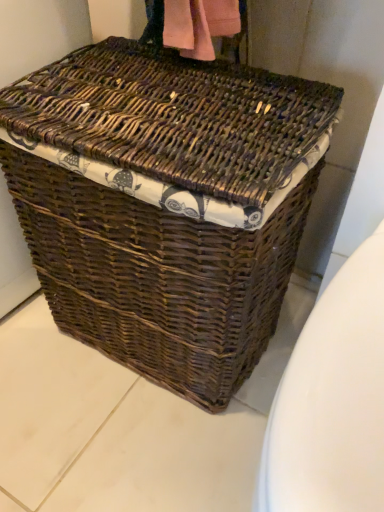
Image resolution: width=384 pixels, height=512 pixels. In order to click on brown wicker picnic basket at center in this screenshot , I will do `click(165, 203)`.

This screenshot has width=384, height=512. What do you see at coordinates (165, 203) in the screenshot? I see `brown wicker picnic basket at center` at bounding box center [165, 203].

The width and height of the screenshot is (384, 512). Describe the element at coordinates (332, 400) in the screenshot. I see `white glossy toilet bowl at lower right` at that location.

Image resolution: width=384 pixels, height=512 pixels. In order to click on white glossy toilet bowl at lower right in this screenshot , I will do `click(332, 400)`.

Locate an element on the screen. This screenshot has height=512, width=384. brown wicker picnic basket at center is located at coordinates (165, 203).

Which is more to the right, white glossy toilet bowl at lower right or brown wicker picnic basket at center?

Positioned to the right is white glossy toilet bowl at lower right.

Is white glossy toilet bowl at lower right positioned in front of brown wicker picnic basket at center?

Yes, it is.

Which point is more distant from viewer, (297, 344) or (77, 242)?

The point (77, 242) is behind.

From the image's perspective, which is above, white glossy toilet bowl at lower right or brown wicker picnic basket at center?

brown wicker picnic basket at center appears higher in the image.

Looking at this image, from a real-world perspective, which is physically above, white glossy toilet bowl at lower right or brown wicker picnic basket at center?

brown wicker picnic basket at center.

Can you confirm if white glossy toilet bowl at lower right is thinner than brown wicker picnic basket at center?

Answer: No, white glossy toilet bowl at lower right is not thinner than brown wicker picnic basket at center.

Is white glossy toilet bowl at lower right shorter than brown wicker picnic basket at center?

Correct, white glossy toilet bowl at lower right is not as tall as brown wicker picnic basket at center.

Is white glossy toilet bowl at lower right bigger or smaller than brown wicker picnic basket at center?

Clearly, white glossy toilet bowl at lower right is smaller in size than brown wicker picnic basket at center.

Is white glossy toilet bowl at lower right inside or outside of brown wicker picnic basket at center?

white glossy toilet bowl at lower right is not inside brown wicker picnic basket at center, it's outside.

Is white glossy toilet bowl at lower right directly adjacent to brown wicker picnic basket at center?

No, white glossy toilet bowl at lower right is not with brown wicker picnic basket at center.

Is white glossy toilet bowl at lower right aimed at brown wicker picnic basket at center?

No, white glossy toilet bowl at lower right does not turn towards brown wicker picnic basket at center.

The width and height of the screenshot is (384, 512). Find the location of `toilet bowl lying below the brown wicker picnic basket at center (from the image's perspective)`. toilet bowl lying below the brown wicker picnic basket at center (from the image's perspective) is located at coordinates (332, 400).

Visually, is brown wicker picnic basket at center positioned to the left or to the right of white glossy toilet bowl at lower right?

Clearly, brown wicker picnic basket at center is on the left of white glossy toilet bowl at lower right in the image.

Relative to white glossy toilet bowl at lower right, is brown wicker picnic basket at center in front or behind?

Visually, brown wicker picnic basket at center is located behind white glossy toilet bowl at lower right.

Considering the positions of point (98, 311) and point (315, 508), is point (98, 311) closer or farther from the camera than point (315, 508)?

Clearly, point (98, 311) is more distant from the camera than point (315, 508).

From the image's perspective, is brown wicker picnic basket at center located above white glossy toilet bowl at lower right?

Indeed, from the image's perspective, brown wicker picnic basket at center is shown above white glossy toilet bowl at lower right.

From the picture: From a real-world perspective, who is located higher, brown wicker picnic basket at center or white glossy toilet bowl at lower right?

From a 3D spatial view, brown wicker picnic basket at center is above.

Which object is thinner, brown wicker picnic basket at center or white glossy toilet bowl at lower right?

brown wicker picnic basket at center is thinner.

Between brown wicker picnic basket at center and white glossy toilet bowl at lower right, which one has more height?

brown wicker picnic basket at center.

Between brown wicker picnic basket at center and white glossy toilet bowl at lower right, which one has smaller size?

white glossy toilet bowl at lower right is smaller.

Is brown wicker picnic basket at center inside or outside of white glossy toilet bowl at lower right?

brown wicker picnic basket at center cannot be found inside white glossy toilet bowl at lower right.

Are brown wicker picnic basket at center and white glossy toilet bowl at lower right far apart?

brown wicker picnic basket at center is near white glossy toilet bowl at lower right, not far away.

Is brown wicker picnic basket at center oriented away from white glossy toilet bowl at lower right?

No, brown wicker picnic basket at center's orientation is not away from white glossy toilet bowl at lower right.

Can you tell me how much brown wicker picnic basket at center and white glossy toilet bowl at lower right differ in facing direction?

0.327 degrees separate the facing orientations of brown wicker picnic basket at center and white glossy toilet bowl at lower right.

Locate an element on the screen. picnic basket located on the left of white glossy toilet bowl at lower right is located at coordinates (165, 203).

In order to click on toilet bowl that is under the brown wicker picnic basket at center (from a real-world perspective) in this screenshot , I will do `click(332, 400)`.

Image resolution: width=384 pixels, height=512 pixels. I want to click on picnic basket that appears above the white glossy toilet bowl at lower right (from a real-world perspective), so click(x=165, y=203).